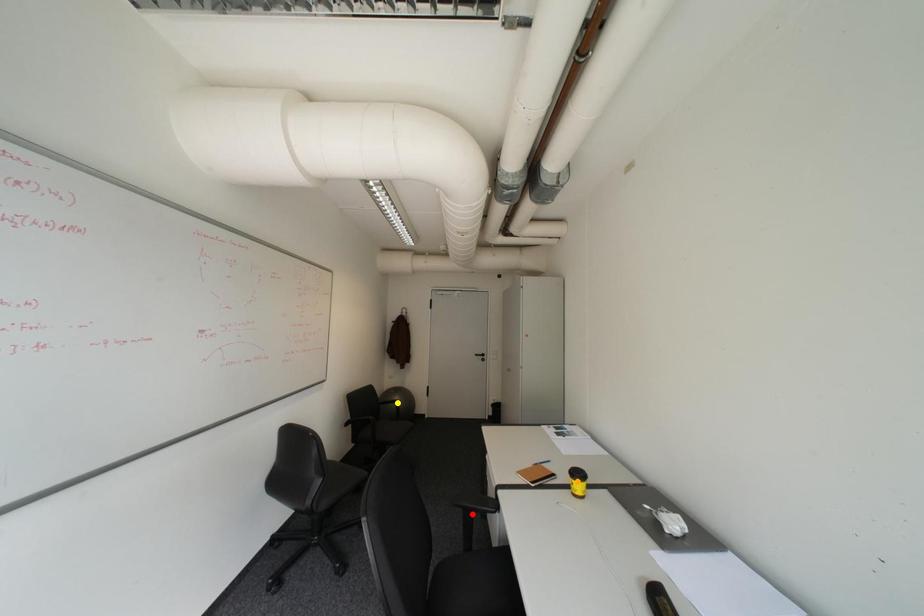
Order these from nearest to farthest:
A) orange point
B) red point
C) yellow point

red point → orange point → yellow point